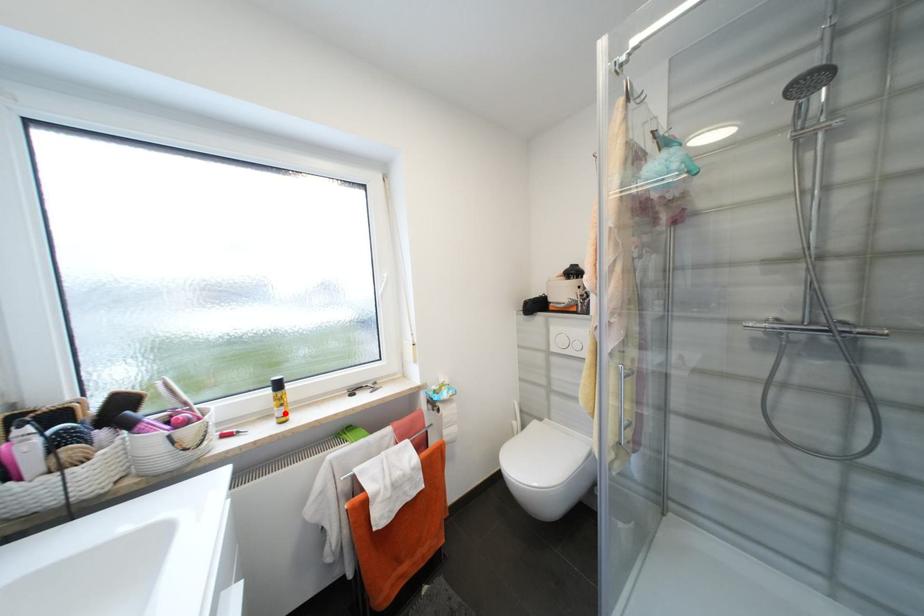
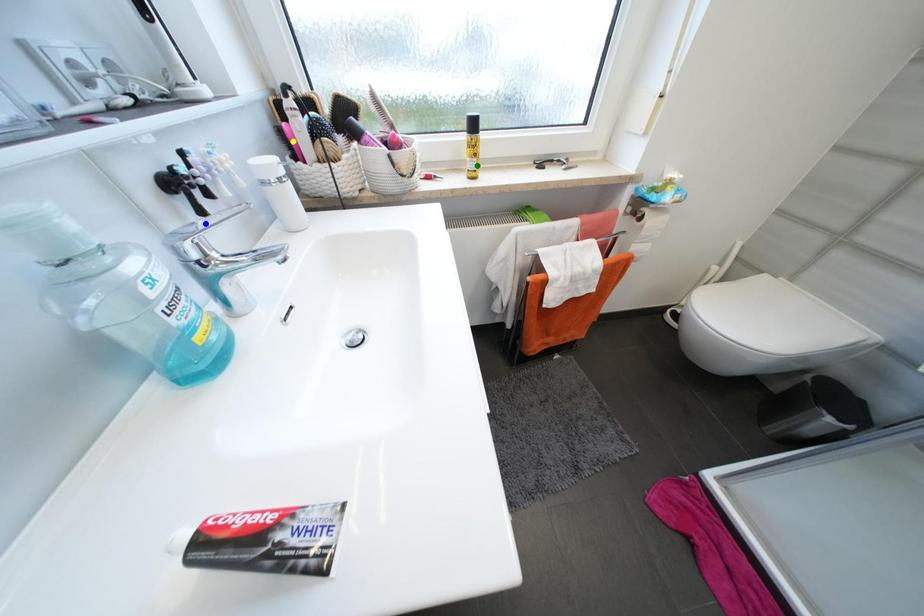
Question: I am providing you with two images of the same scene from different viewpoints. A red point is marked on the first image. You are given multiple points on the second image. In image 2, which mark is for the same physical point as the one in image 1?

Choices:
 (A) yellow point
 (B) blue point
 (C) green point

Answer: (C)